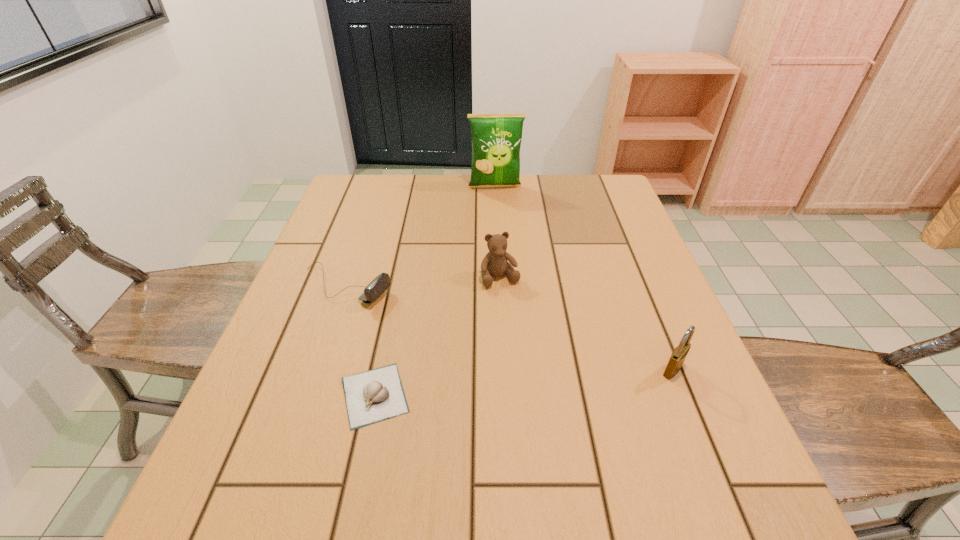
I want to click on the shortest object, so click(376, 395).

Where is `padlock`? padlock is located at coordinates pyautogui.click(x=678, y=356).

The height and width of the screenshot is (540, 960). In order to click on webcam in this screenshot , I will do `click(381, 283)`.

The height and width of the screenshot is (540, 960). I want to click on the farthest object, so click(496, 138).

You are a GUI agent. You are given a task and a screenshot of the screen. Output one action in this format:
    pyautogui.click(x=<x>, y=<y>)
    Task: Click on the tallest object
    This screenshot has height=540, width=960.
    Given the screenshot: What is the action you would take?
    pyautogui.click(x=496, y=138)

You are a GUI agent. You are given a task and a screenshot of the screen. Output one action in this format:
    pyautogui.click(x=<x>, y=<y>)
    Task: Click on the teddy bear
    
    Given the screenshot: What is the action you would take?
    tap(495, 263)

Identify the location of vacant space situated on the right of the garlic. (622, 395).

Where is `vacant space located 0.120m on the front of the padlock`? vacant space located 0.120m on the front of the padlock is located at coordinates (700, 436).

Identify the location of vacant region located 0.150m on the front-facing side of the second shortest object. This screenshot has width=960, height=540. (439, 320).

The image size is (960, 540). I want to click on free location located on the front-facing side of the second shortest object, so click(427, 315).